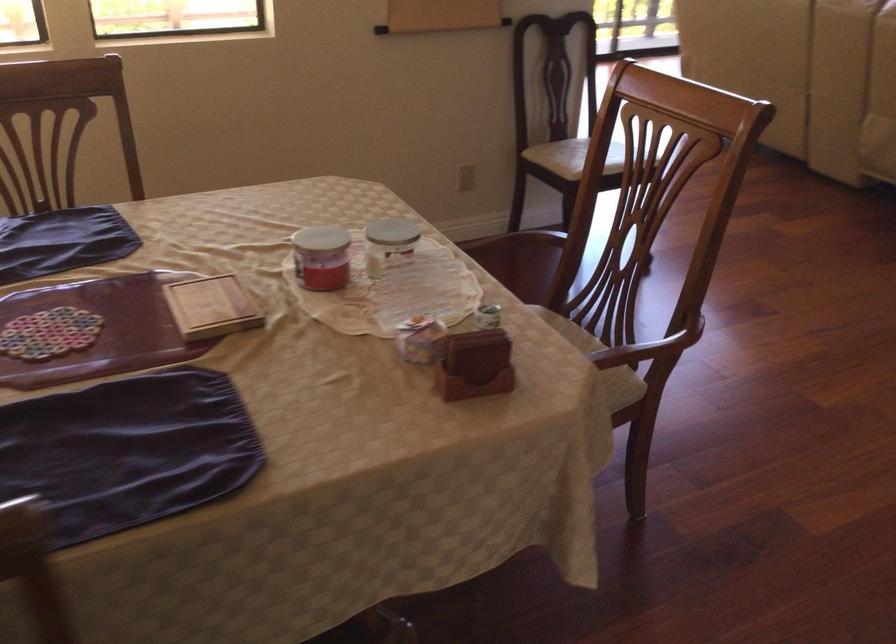
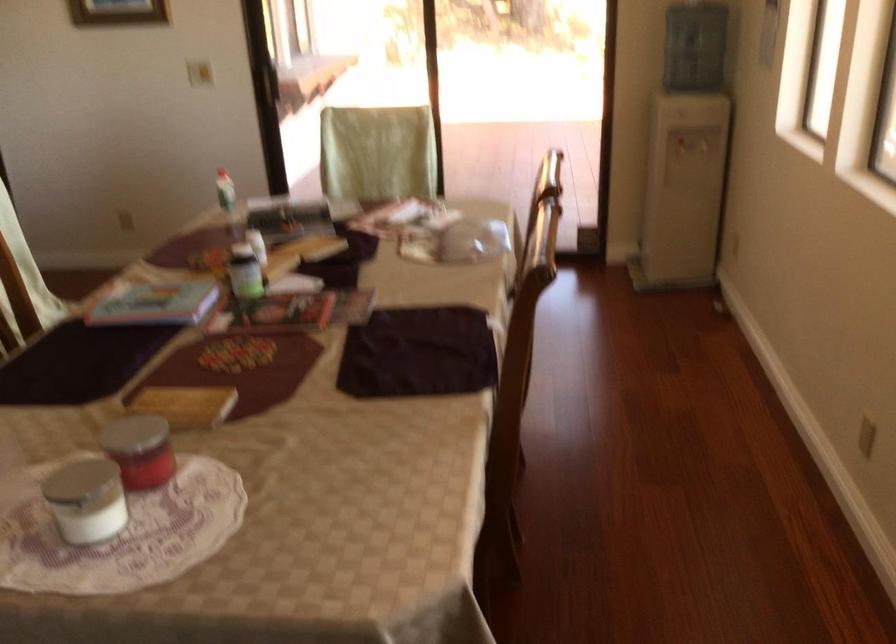
The point at (323, 256) is marked in the first image. Where is the corresponding point in the second image?

(162, 465)